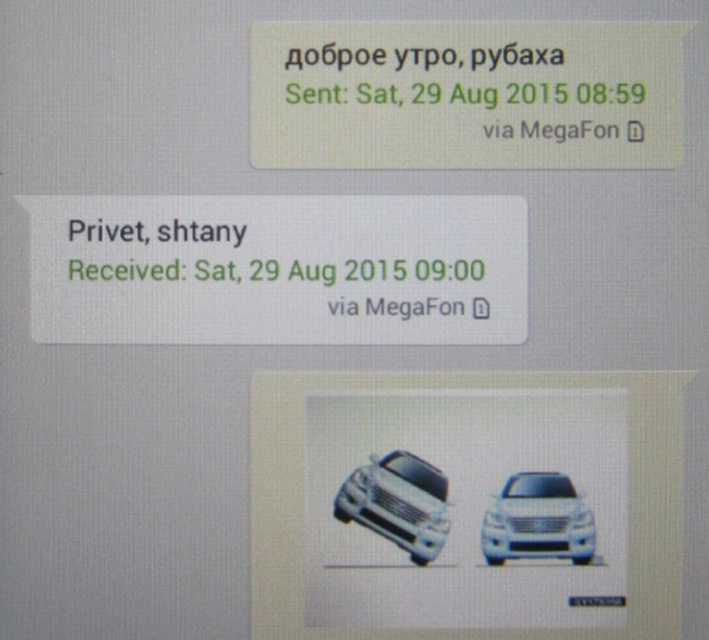
You are looking at a photo of a parking lot. You see a white glossy suv at center and a white glossy car at center. Which one is higher up in the photo?

The white glossy suv at center is located above the white glossy car at center in the photo.

You are a delivery person who needs to place a white paper at center and a white glossy car at center on a desk. According to the scene, which object should be placed to the left side of the desk?

The white paper at center should be placed to the left side of the desk because it is to the left of the white glossy car at center according to the scene description.